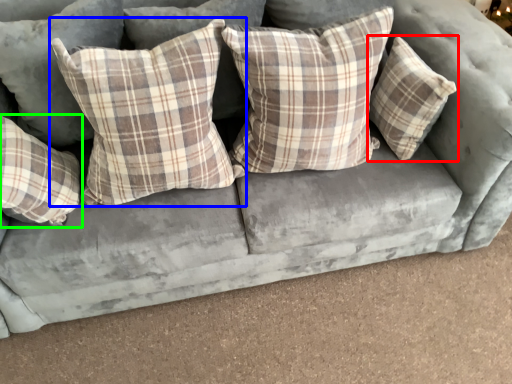
Question: Which is nearer to the pillow (highlighted by a red box)? pillow (highlighted by a blue box) or pillow (highlighted by a green box).

Choices:
 (A) pillow
 (B) pillow

Answer: (A)